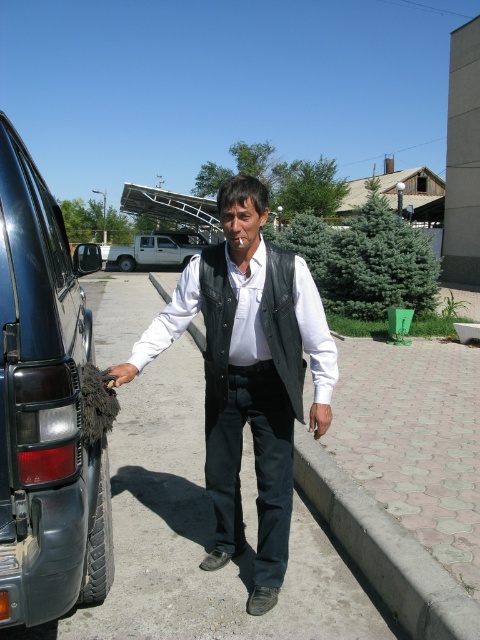
Does point (52, 509) lie behind point (132, 257)?

No.

Between dark gray rubber tire at left and white matte pickup truck at center, which one is positioned lower?

dark gray rubber tire at left

Locate an element on the screen. The width and height of the screenshot is (480, 640). dark gray rubber tire at left is located at coordinates (46, 406).

This screenshot has width=480, height=640. Find the location of `dark gray rubber tire at left`. dark gray rubber tire at left is located at coordinates (46, 406).

From the picture: Who is higher up, dark gray rubber tire at left or leather vest at center?

Positioned higher is dark gray rubber tire at left.

Between point (62, 422) and point (276, 282), which one is positioned behind?

The point (276, 282) is behind.

What do you see at coordinates (46, 406) in the screenshot? The width and height of the screenshot is (480, 640). I see `dark gray rubber tire at left` at bounding box center [46, 406].

Locate an element on the screen. The height and width of the screenshot is (640, 480). dark gray rubber tire at left is located at coordinates (46, 406).

Who is positioned more to the left, black leather vest at center or leather vest at center?

black leather vest at center

Who is shorter, black leather vest at center or leather vest at center?

leather vest at center

Between point (269, 268) and point (278, 300), which one is positioned behind?

The point (269, 268) is more distant.

At what (x,y) coordinates should I click in order to perform the action: click on black leather vest at center. Please return your answer as a coordinate pair (x, y). Looking at the image, I should click on (249, 372).